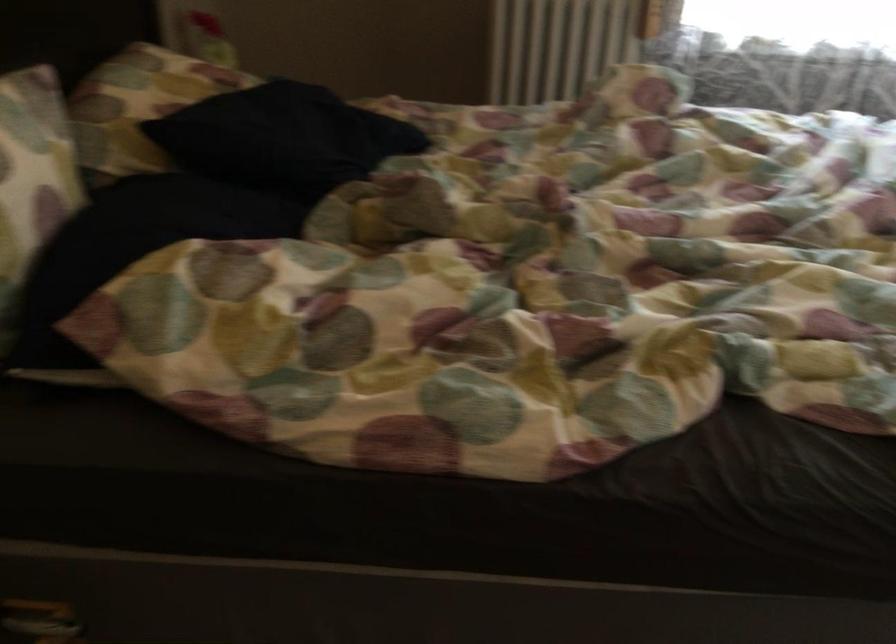
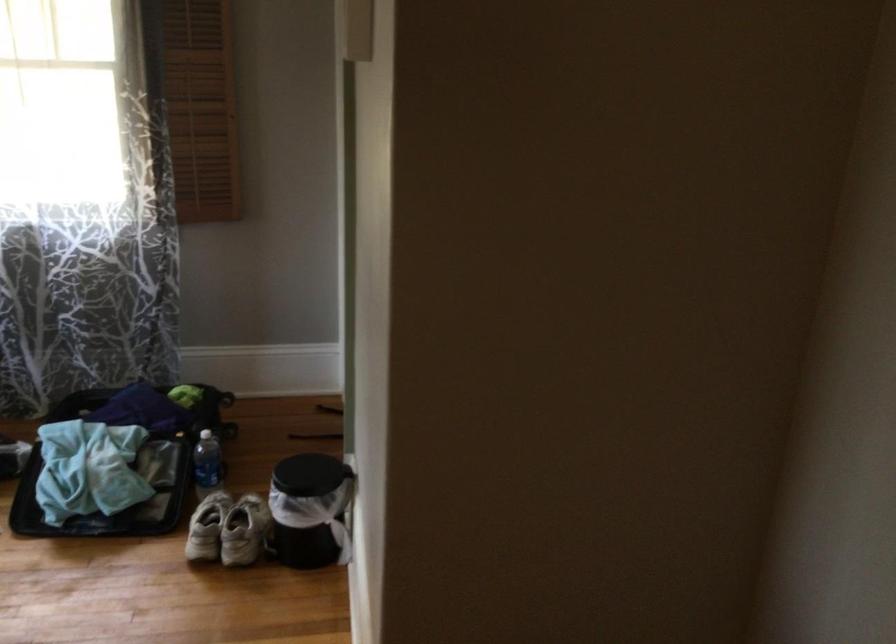
How did the camera likely rotate?

The camera's rotation is toward right-down.